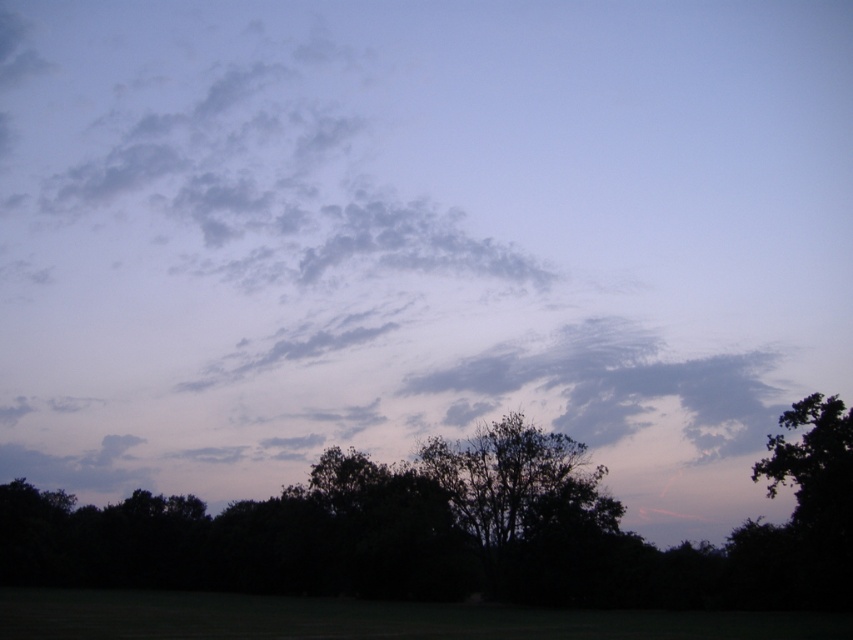
Question: Does silhouette tree at lower center appear on the right side of silhouette leafy tree at center?

Choices:
 (A) no
 (B) yes

Answer: (A)

Question: Which point appears closest to the camera in this image?

Choices:
 (A) (799, 461)
 (B) (541, 502)

Answer: (A)

Question: Can you confirm if silhouette tree at lower center is wider than silhouette leafy tree at center?

Choices:
 (A) yes
 (B) no

Answer: (A)

Question: Among these objects, which one is farthest from the camera?

Choices:
 (A) silhouette leafy tree at center
 (B) silhouette tree at lower center

Answer: (A)

Question: Does silhouette tree at lower center have a larger size compared to silhouette leafy tree at center?

Choices:
 (A) yes
 (B) no

Answer: (A)